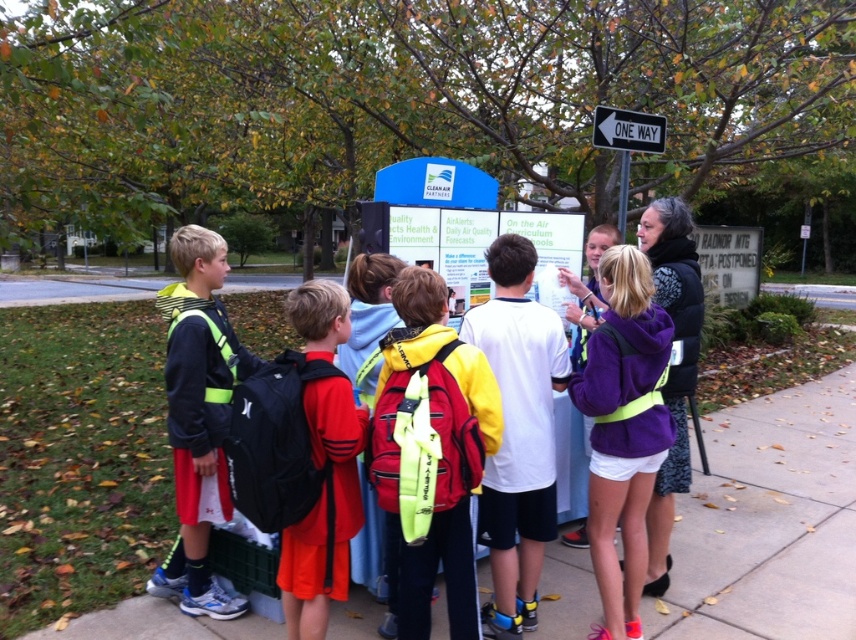
Question: Can you confirm if cement sidewalk at lower center is smaller than black plastic one way sign at upper right?

Choices:
 (A) no
 (B) yes

Answer: (B)

Question: Which point is closer to the camera?

Choices:
 (A) metallic silver arrow at upper right
 (B) red matte backpack at center

Answer: (B)

Question: Estimate the real-world distances between objects in this image. Which object is farther from the red matte backpack at center?

Choices:
 (A) black plastic one way sign at upper right
 (B) matte black jacket at left

Answer: (A)

Question: Can you confirm if cement sidewalk at lower center is wider than red matte backpack at center?

Choices:
 (A) no
 (B) yes

Answer: (B)

Question: Considering the relative positions of purple fleece jacket at center and black plastic one way sign at upper right in the image provided, where is purple fleece jacket at center located with respect to black plastic one way sign at upper right?

Choices:
 (A) above
 (B) below

Answer: (B)

Question: Which point is closer to the camera?

Choices:
 (A) (484, 563)
 (B) (342, 595)
 (C) (602, 122)
 (D) (645, 449)

Answer: (B)